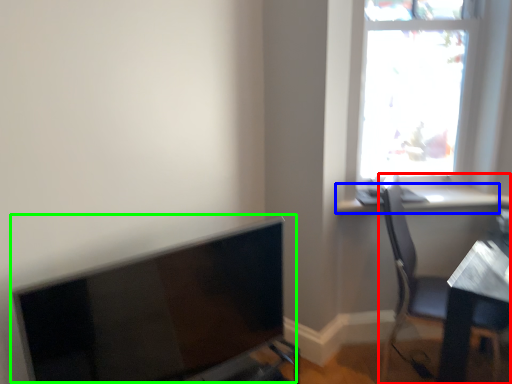
Question: Which object is the closest to the chair (highlighted by a red box)? Choose among these: window sill (highlighted by a blue box) or computer monitor (highlighted by a green box).

Choices:
 (A) window sill
 (B) computer monitor

Answer: (A)